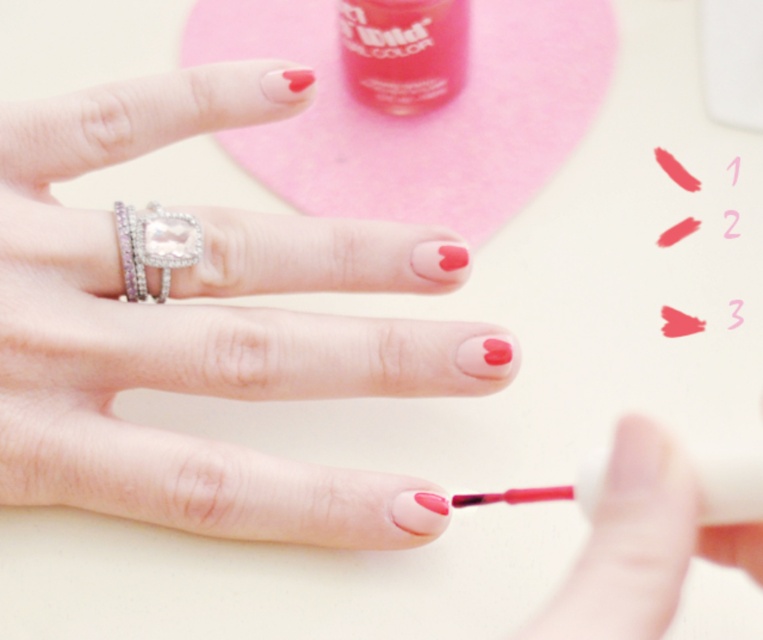
Question: Which of the following is the closest to the observer?

Choices:
 (A) (430, 330)
 (B) (538, 497)
 (C) (139, 236)

Answer: (B)

Question: Is diamond ring at left smaller than matte pink lipstick at lower center?

Choices:
 (A) yes
 (B) no

Answer: (A)

Question: Which of the following is the closest to the observer?

Choices:
 (A) (526, 499)
 (B) (176, 337)
 (C) (185, 243)

Answer: (A)

Question: Among these objects, which one is farthest from the camera?

Choices:
 (A) matte pink nail polish at center
 (B) diamond ring at left

Answer: (B)

Question: Can you confirm if diamond ring at left is positioned below matte pink lipstick at lower center?

Choices:
 (A) no
 (B) yes

Answer: (A)

Question: Is matte pink nail polish at center positioned in front of diamond ring at left?

Choices:
 (A) no
 (B) yes

Answer: (B)